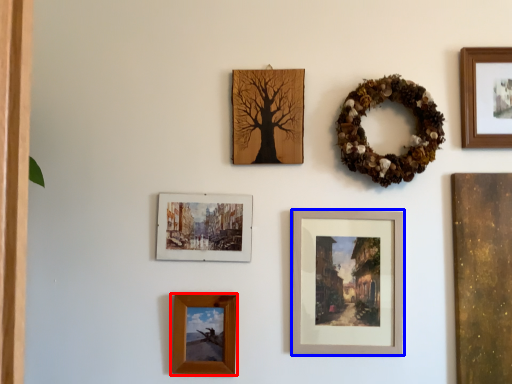
Question: Which object is closer to the camera taking this photo, picture frame (highlighted by a red box) or picture frame (highlighted by a blue box)?

Choices:
 (A) picture frame
 (B) picture frame

Answer: (A)